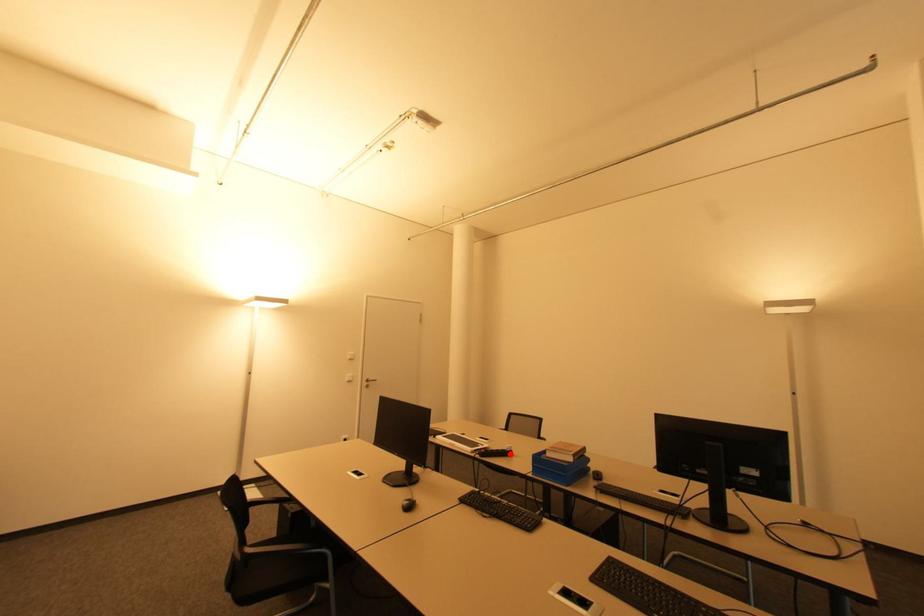
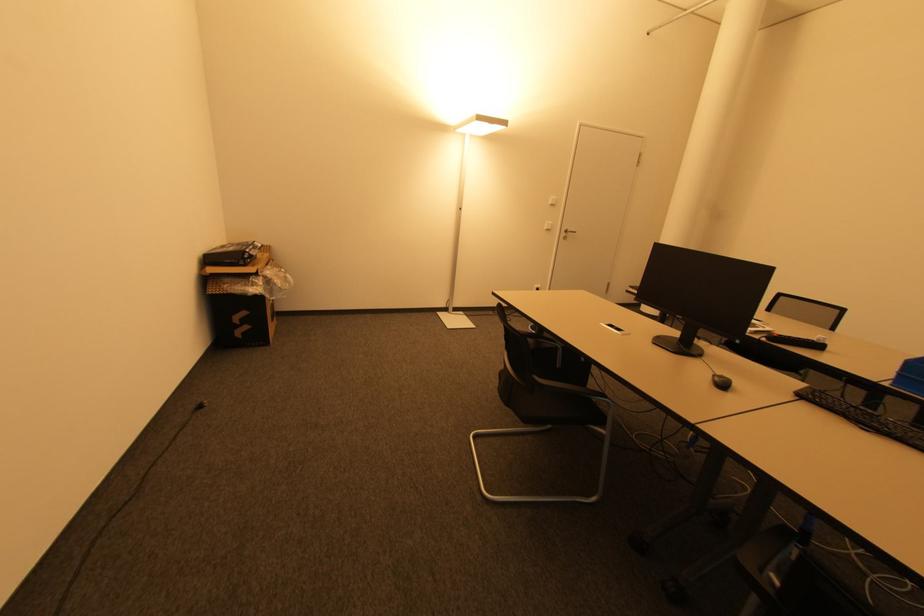
The point at the highlighted location is marked in the first image. Where is the corresponding point in the second image?

(819, 346)